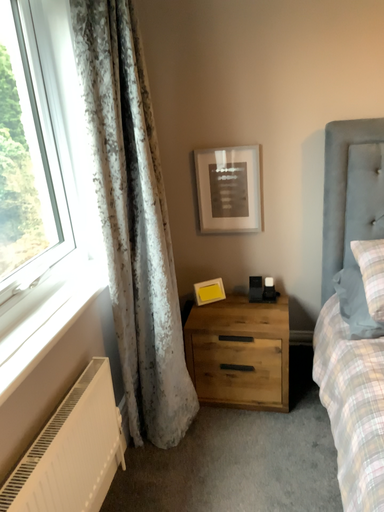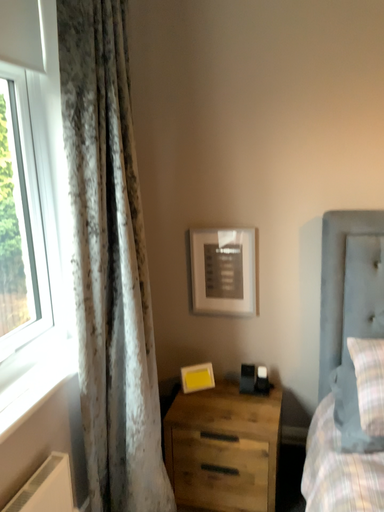
Question: How did the camera likely rotate when shooting the video?

Choices:
 (A) rotated upward
 (B) rotated downward

Answer: (A)